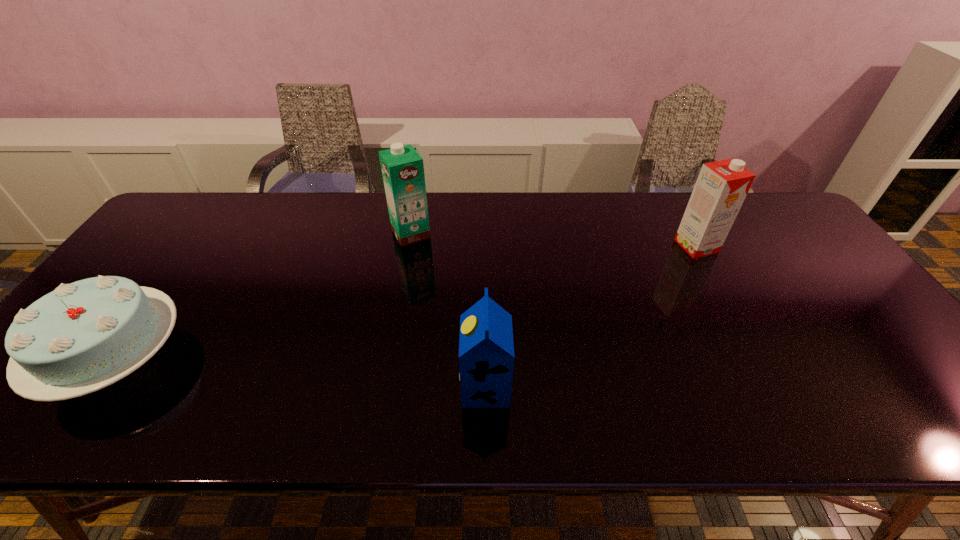
The width and height of the screenshot is (960, 540). I want to click on object that stands as the second closest to the rightmost carton, so click(402, 167).

Identify which carton is the closest to the rightmost carton. Please provide its 2D coordinates. Your answer should be formatted as a tuple, i.e. [(x, y)], where the tuple contains the x and y coordinates of a point satisfying the conditions above.

[(486, 350)]

Find the location of a particular element. The image size is (960, 540). the second closest carton to the leftmost carton is located at coordinates (722, 186).

You are a GUI agent. You are given a task and a screenshot of the screen. Output one action in this format:
    pyautogui.click(x=<x>, y=<y>)
    Task: Click on the free location that satisfies the following two spatial constraints: 1. on the front side of the rightmost carton; 2. on the left side of the third object from right to left
    This screenshot has height=540, width=960.
    Given the screenshot: What is the action you would take?
    pyautogui.click(x=409, y=246)